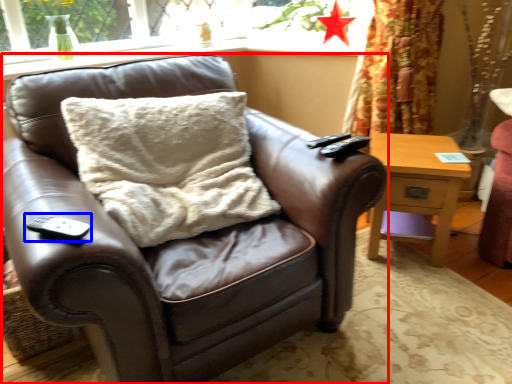
Question: Which point is further to the camera, chair (highlighted by a red box) or remote (highlighted by a blue box)?

Choices:
 (A) chair
 (B) remote

Answer: (B)